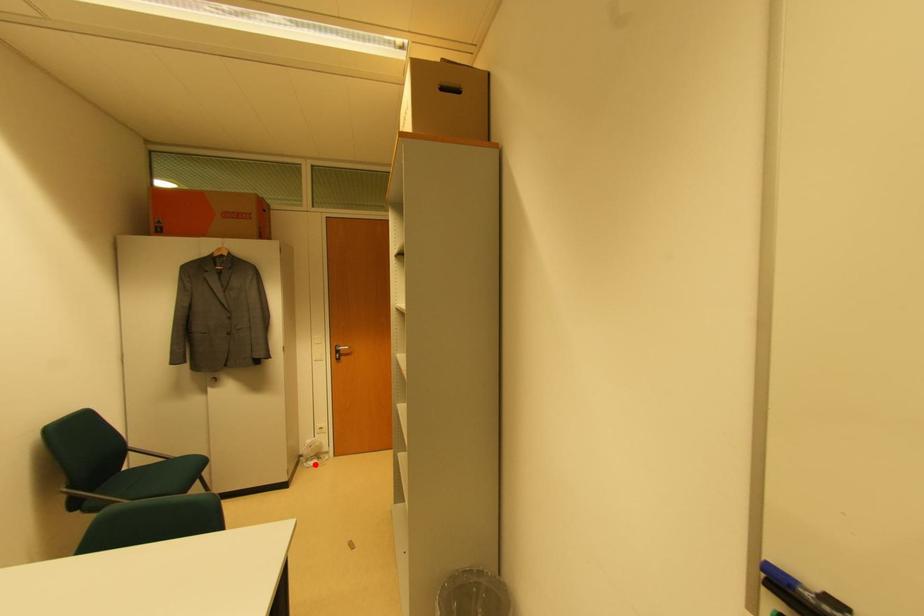
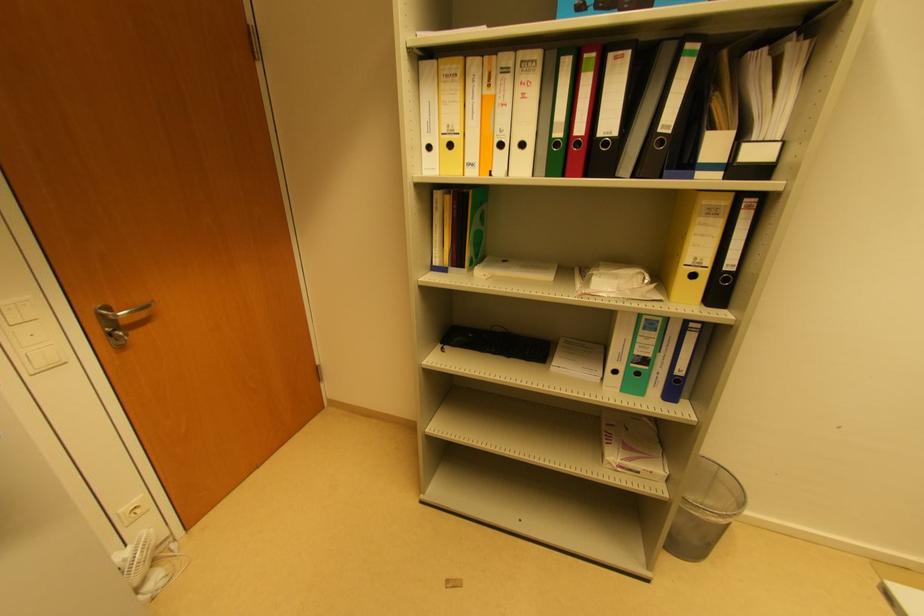
Locate, in the second image, the point that corresponds to the highlighted location in the first image.

(157, 580)